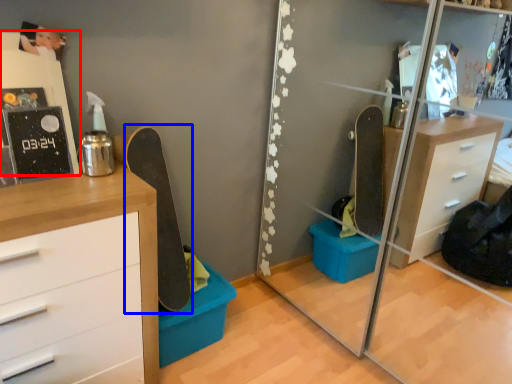
Question: Which point is further to the camera, shelf (highlighted by a red box) or skateboard (highlighted by a blue box)?

Choices:
 (A) shelf
 (B) skateboard

Answer: (B)